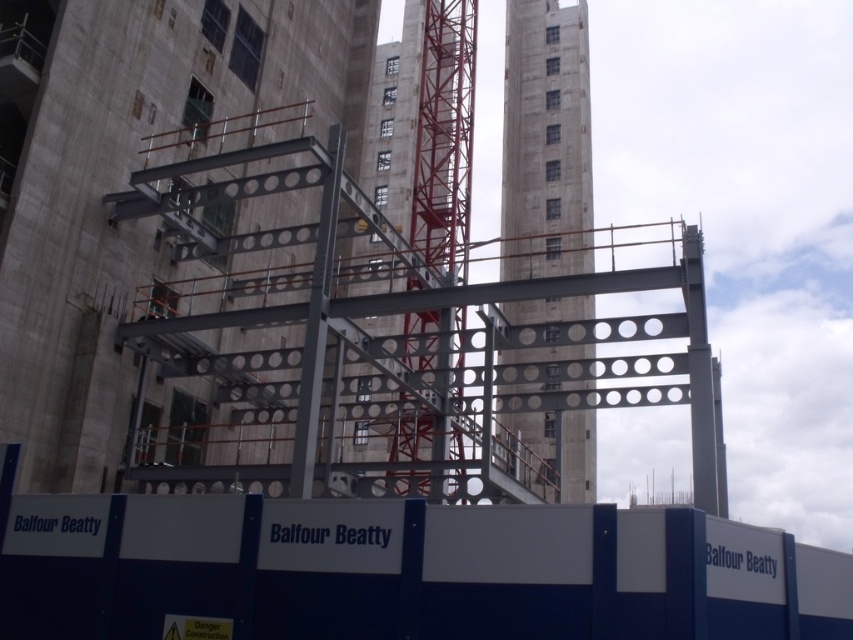
You are an inspector at the construction site. You need to check the stability of the metallic gray steel frame at center and the red metal crane at center. Which object is positioned higher in the image?

The metallic gray steel frame at center is positioned above the red metal crane at center, so it is higher.

You are a safety inspector standing in front of the blue and white barrier. You need to check the distance between the concrete tower at center and the red metal crane at center. Which one is closer to you?

The concrete tower at center is closer to the viewer than the red metal crane at center.

From the picture: You are an inspector at the construction site. You need to determine which structure is shorter between the metallic gray steel frame at center and the concrete tower at center. Based on the scene, which one is shorter?

The metallic gray steel frame at center is shorter than the concrete tower at center.